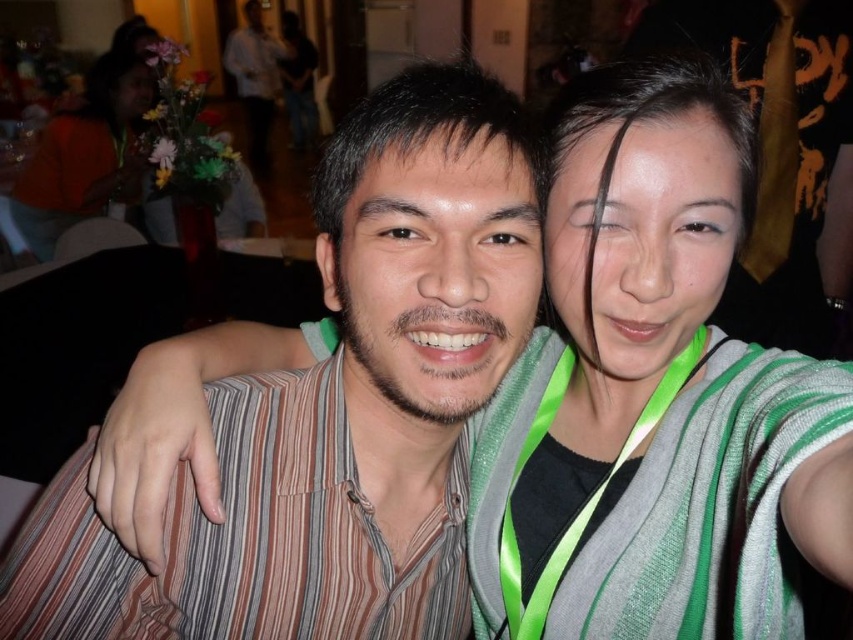
Question: Does green striped sweater at center appear on the right side of striped shirt at center?

Choices:
 (A) no
 (B) yes

Answer: (B)

Question: Can you confirm if striped shirt at center is positioned to the left of orange fabric at upper left?

Choices:
 (A) no
 (B) yes

Answer: (A)

Question: Which is nearer to the green striped sweater at center?

Choices:
 (A) orange fabric at upper left
 (B) striped shirt at center

Answer: (B)

Question: Which is nearer to the green striped sweater at center?

Choices:
 (A) striped shirt at center
 (B) orange fabric at upper left

Answer: (A)

Question: Among these objects, which one is farthest from the camera?

Choices:
 (A) orange fabric at upper left
 (B) striped shirt at center

Answer: (A)

Question: Is green striped sweater at center thinner than striped shirt at center?

Choices:
 (A) no
 (B) yes

Answer: (B)